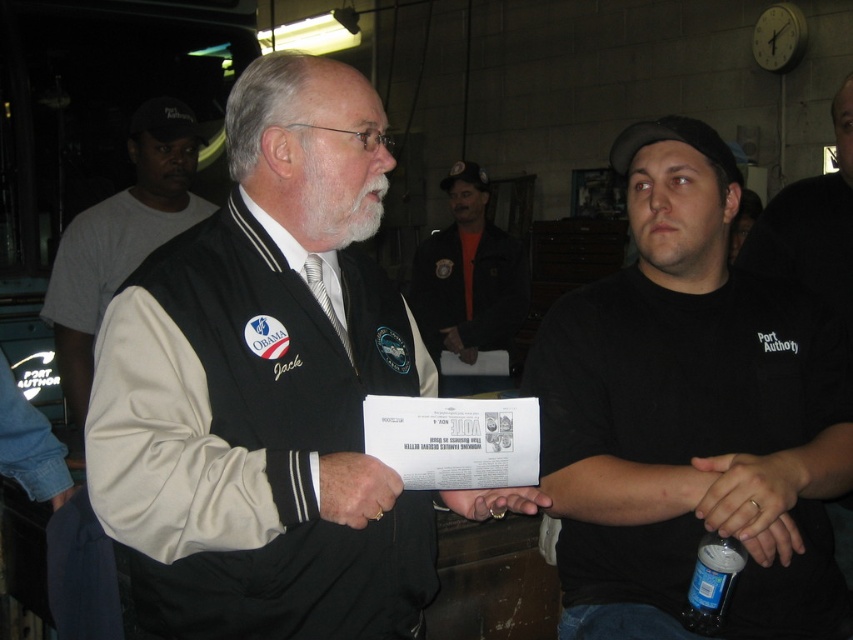
You are standing in the workshop and see two points marked on the wall. The first point is at coordinates point (80, 253) and the second is at point (519, 492). Which point is closer to you?

Point (519, 492) is closer to you because it is in front of point (80, 253).

You are a tailor observing a man wearing a black fabric jacket at center and a black cotton shirt at center. Which clothing item is narrower in width?

The black fabric jacket at center is thinner than the black cotton shirt at center, so the black fabric jacket at center is narrower in width.